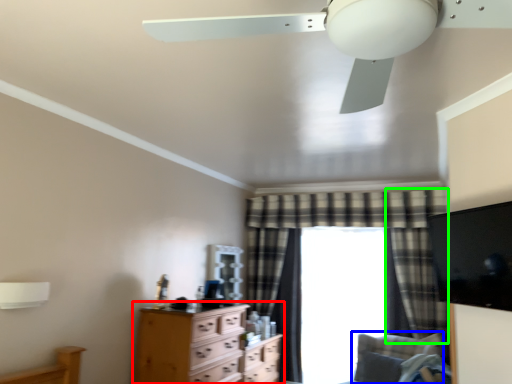
Question: Considering the real-world distances, which object is farthest from chest of drawers (highlighted by a red box)? swivel chair (highlighted by a blue box) or curtain (highlighted by a green box)?

Choices:
 (A) swivel chair
 (B) curtain

Answer: (B)